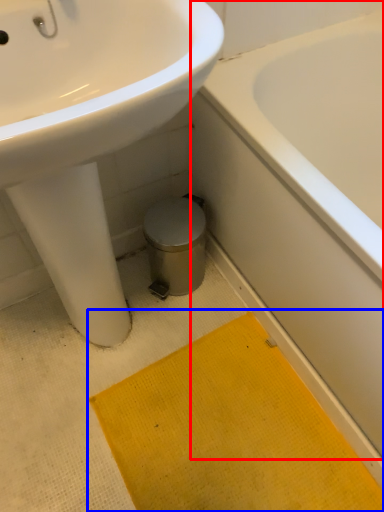
Question: Which of the following is the closest to the observer, bathtub (highlighted by a red box) or bath mat (highlighted by a blue box)?

Choices:
 (A) bathtub
 (B) bath mat

Answer: (A)